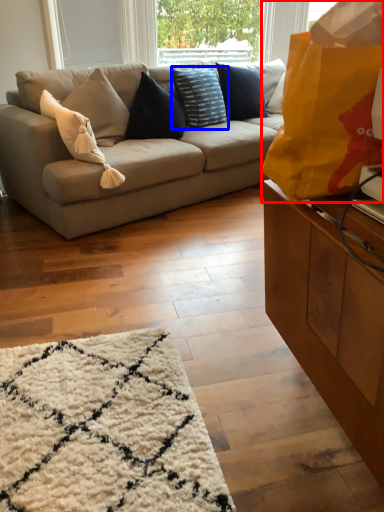
Question: Which object appears farthest to the camera in this image, bag (highlighted by a red box) or pillow (highlighted by a blue box)?

Choices:
 (A) bag
 (B) pillow

Answer: (B)